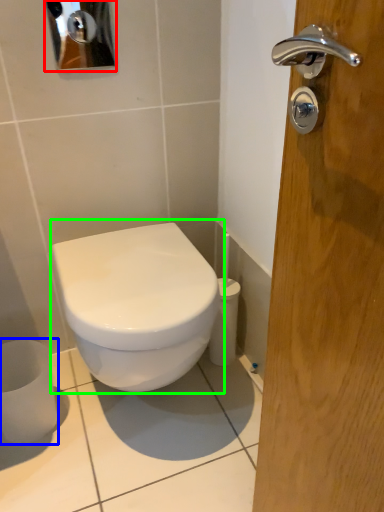
Question: Based on their relative distances, which object is farther from mirror (highlighted by a red box)? Choose from toilet paper (highlighted by a blue box) and toilet (highlighted by a green box).

Choices:
 (A) toilet paper
 (B) toilet

Answer: (A)